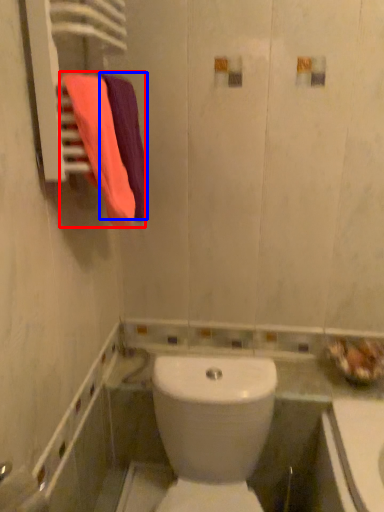
Question: Which point is further to the camera, bath towel (highlighted by a red box) or bath towel (highlighted by a blue box)?

Choices:
 (A) bath towel
 (B) bath towel

Answer: (B)